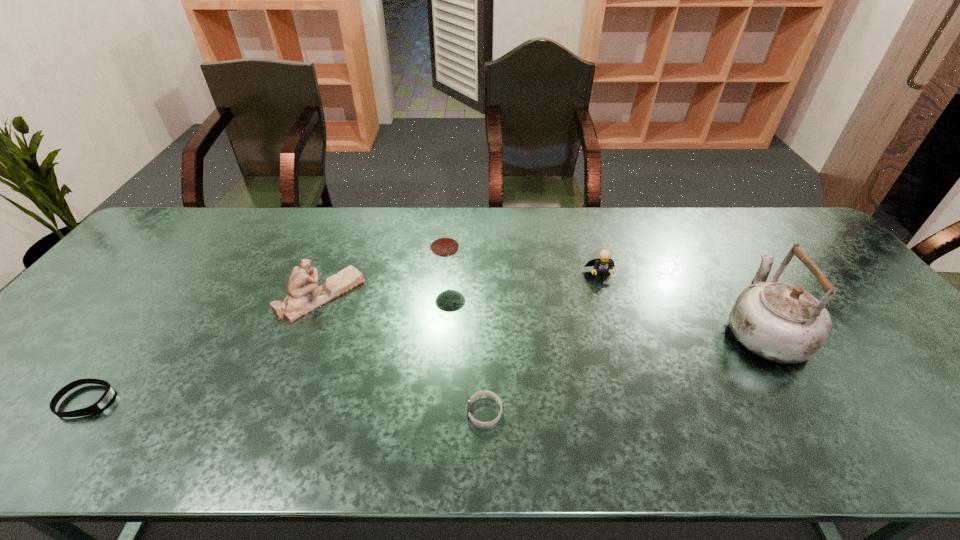
Where is `vacant region at the far edge of the desktop`? This screenshot has height=540, width=960. vacant region at the far edge of the desktop is located at coordinates (517, 226).

You are a GUI agent. You are given a task and a screenshot of the screen. Output one action in this format:
    pyautogui.click(x=<x>, y=<y>)
    Task: Click on the vacant space at the near edge of the desktop
    
    Given the screenshot: What is the action you would take?
    pyautogui.click(x=817, y=436)

You are a GUI agent. You are given a task and a screenshot of the screen. Output one action in this format:
    pyautogui.click(x=<x>, y=<y>)
    Task: Click on the free space at the left edge
    This screenshot has height=540, width=960.
    Given the screenshot: What is the action you would take?
    pyautogui.click(x=101, y=337)

This screenshot has width=960, height=540. Identify the location of vacant space at the right edge of the desktop. (850, 319).

I want to click on vacant region between the left wristband and the tallest object, so click(x=425, y=365).

Where is `vacant area that lies between the fifth object from right to left and the rightmost object`? Image resolution: width=960 pixels, height=540 pixels. vacant area that lies between the fifth object from right to left and the rightmost object is located at coordinates (542, 312).

Image resolution: width=960 pixels, height=540 pixels. In order to click on empty location between the wineglass and the figurine in this screenshot , I will do `click(384, 286)`.

Image resolution: width=960 pixels, height=540 pixels. In order to click on vacant area between the fourth tallest object and the third object from right to left in this screenshot , I will do `click(542, 343)`.

Locate an element on the screen. The image size is (960, 540). unoccupied position between the right wristband and the fourth tallest object is located at coordinates (542, 343).

The height and width of the screenshot is (540, 960). Identify the location of vacant area that lies between the third shortest object and the kettle. (682, 302).